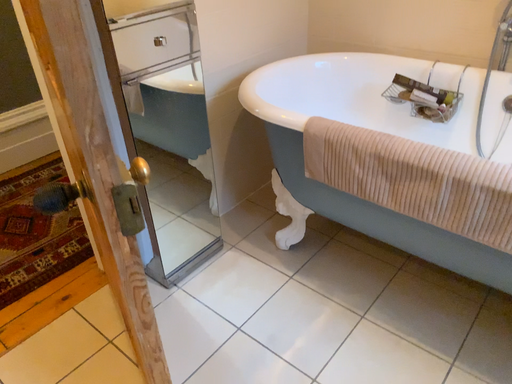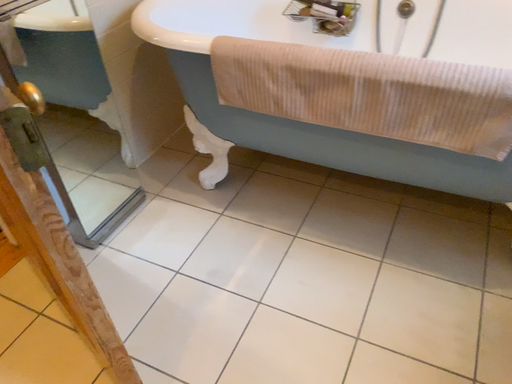
Question: How did the camera likely rotate when shooting the video?

Choices:
 (A) rotated left
 (B) rotated right

Answer: (B)